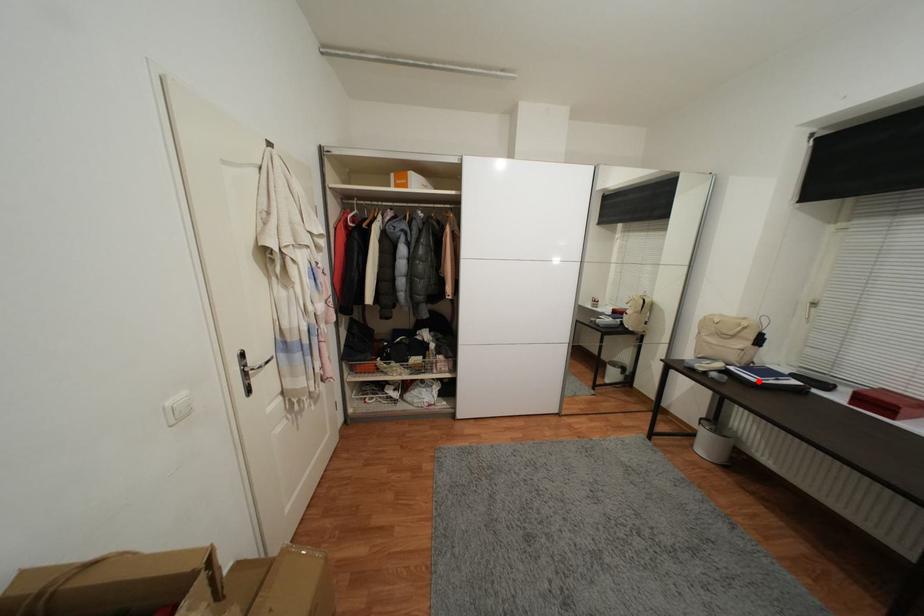
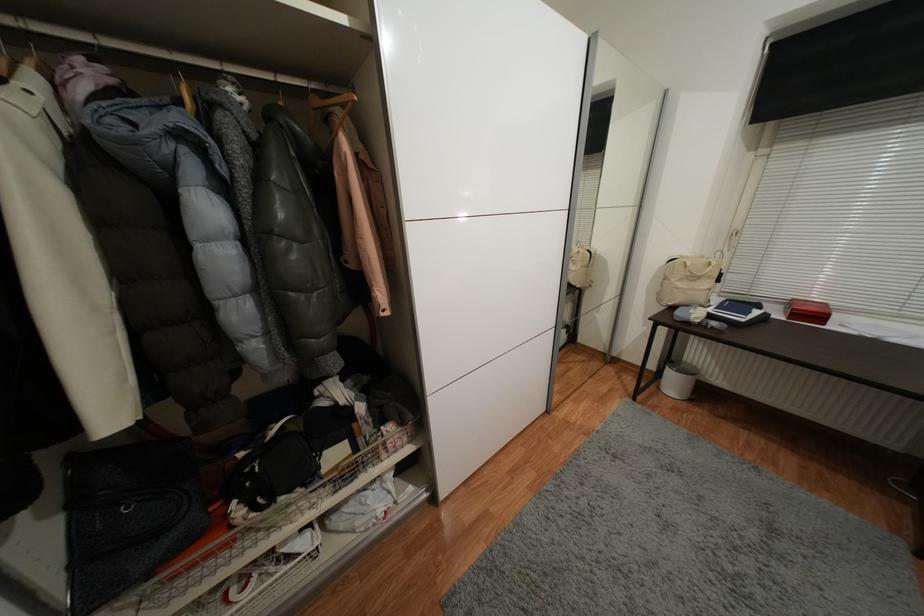
The point at the highlighted location is marked in the first image. Where is the corresponding point in the second image?

(747, 321)